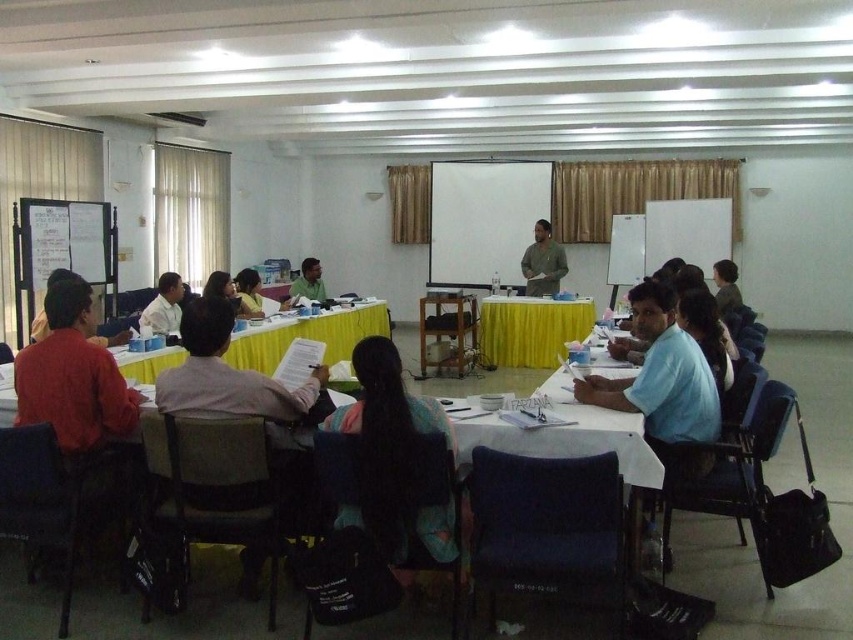
Does dark blue fabric chair at lower left have a lesser width compared to blue fabric chair at lower right?

Correct, dark blue fabric chair at lower left's width is less than blue fabric chair at lower right's.

Is point (7, 436) positioned in front of point (718, 445)?

Yes, point (7, 436) is closer to viewer.

Who is more distant from viewer, (32, 472) or (730, 502)?

The point (730, 502) is more distant.

This screenshot has height=640, width=853. I want to click on dark blue fabric chair at lower left, so click(x=55, y=493).

Measure the distance from white matte projection screen at center to matte green shirt at center.

white matte projection screen at center and matte green shirt at center are 1.81 meters apart.

Is white matte projection screen at center positioned in front of matte green shirt at center?

No, white matte projection screen at center is behind matte green shirt at center.

Where is `white matte projection screen at center`? The image size is (853, 640). white matte projection screen at center is located at coordinates (485, 218).

Identify the location of white matte projection screen at center. Image resolution: width=853 pixels, height=640 pixels. (485, 218).

Does dark blue fabric chair at lower left appear under matte green shirt at center?

Indeed, dark blue fabric chair at lower left is positioned under matte green shirt at center.

Does point (3, 524) come behind point (538, 280)?

No, (3, 524) is closer to viewer.

Between point (61, 483) and point (549, 276), which one is positioned behind?

Positioned behind is point (549, 276).

Locate an element on the screen. The height and width of the screenshot is (640, 853). dark blue fabric chair at lower left is located at coordinates (55, 493).